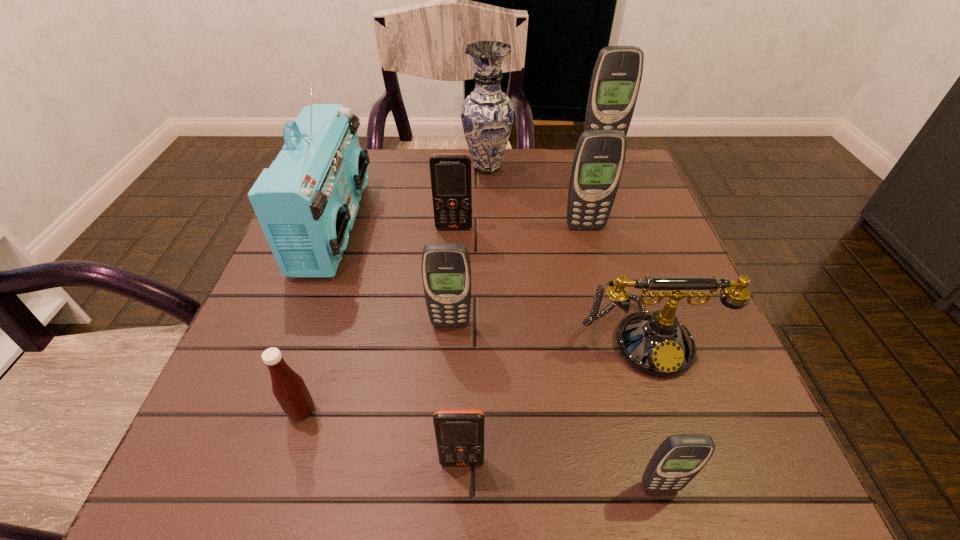
You are a GUI agent. You are given a task and a screenshot of the screen. Output one action in this format:
    pyautogui.click(x=<x>, y=<y>)
    Task: Click on the free spot located 0.100m on the screen of the third biggest gray cellular telephone
    
    Given the screenshot: What is the action you would take?
    pyautogui.click(x=447, y=377)

Image resolution: width=960 pixels, height=540 pixels. Find the location of `free space located on the screen of the bigger orange cellular telephone`. free space located on the screen of the bigger orange cellular telephone is located at coordinates (449, 296).

Find the location of a particular element. free space located on the dial of the black telephone is located at coordinates (680, 441).

Image resolution: width=960 pixels, height=540 pixels. Identify the location of free spot located 0.360m on the back of the white Tabasco sauce. (353, 244).

Image resolution: width=960 pixels, height=540 pixels. In order to click on vase located at the far edge in this screenshot , I will do `click(487, 115)`.

Identify the location of radio receiver at the far edge. The height and width of the screenshot is (540, 960). (306, 202).

You are a GUI agent. You are given a task and a screenshot of the screen. Output one action in this format:
    pyautogui.click(x=<x>, y=<y>)
    Task: Click on the cellular telephone located in the far edge section of the desktop
    This screenshot has width=960, height=540.
    Given the screenshot: What is the action you would take?
    pyautogui.click(x=616, y=78)

In order to click on radio receiver positioned at the left edge in this screenshot , I will do click(306, 202).

Image resolution: width=960 pixels, height=540 pixels. Identify the location of Tabasco sauce at the left edge. (288, 387).

Identify the location of telephone located in the right edge section of the desktop. Image resolution: width=960 pixels, height=540 pixels. (655, 343).